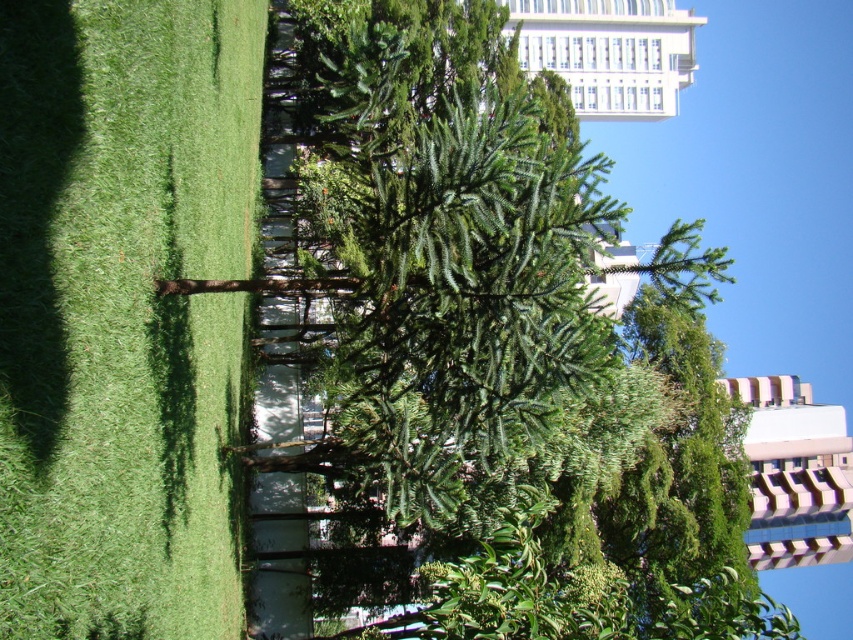
Which is more to the right, white striped building at upper center or white glass building at upper center?

Positioned to the right is white striped building at upper center.

Is white striped building at upper center to the right of white glass building at upper center from the viewer's perspective?

Correct, you'll find white striped building at upper center to the right of white glass building at upper center.

Between point (837, 516) and point (613, 67), which one is positioned in front?

Point (837, 516)

Where is `white striped building at upper center`? The image size is (853, 640). white striped building at upper center is located at coordinates (795, 474).

Is point (734, 576) positioned after point (747, 448)?

No, (734, 576) is closer to viewer.

Is point (524, 493) closer to camera compared to point (805, 440)?

Yes, it is.

The width and height of the screenshot is (853, 640). I want to click on green needle-like at center, so click(x=489, y=356).

Who is shorter, green grass at left or white striped building at upper center?

green grass at left

Does green grass at left appear under white striped building at upper center?

No.

Is point (96, 266) positioned behind point (802, 458)?

That is False.

At what (x,y) coordinates should I click in order to perform the action: click on green grass at left. Please return your answer as a coordinate pair (x, y). The height and width of the screenshot is (640, 853). Looking at the image, I should click on (122, 310).